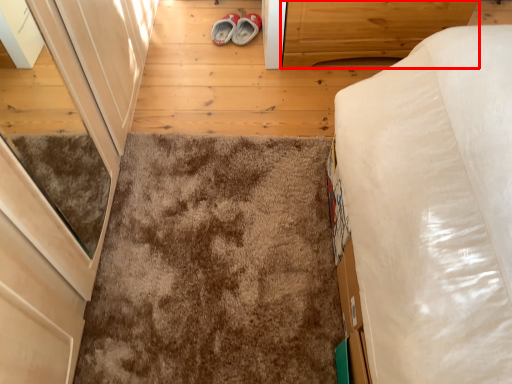
Question: From the image's perspective, where is cabinetry (annotated by the red box) located in relation to mat in the image?

Choices:
 (A) above
 (B) below

Answer: (A)